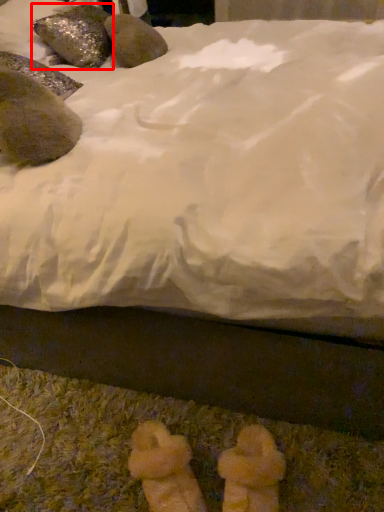
Question: Observing the image, what is the correct spatial positioning of animal (annotated by the red box) in reference to animal?

Choices:
 (A) left
 (B) right

Answer: (A)